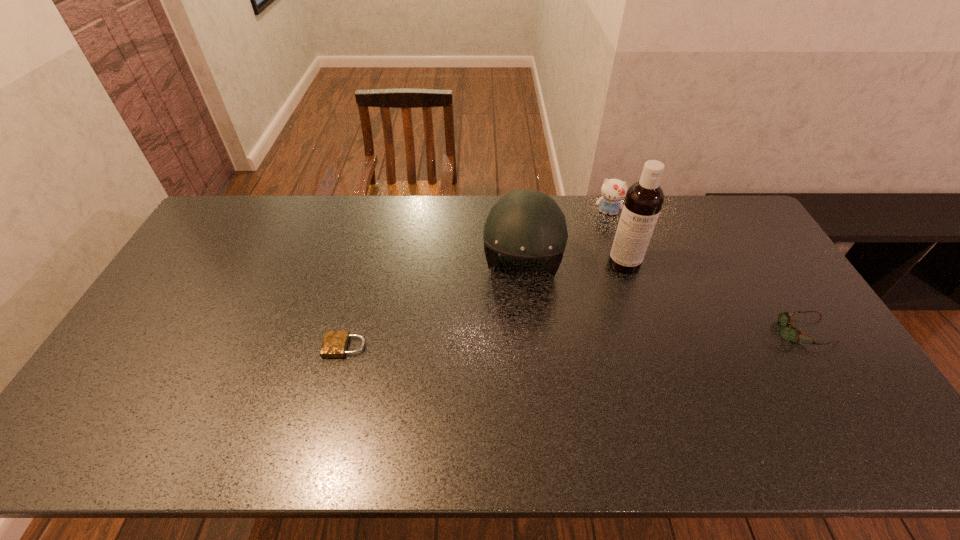
Locate an element on the screen. The height and width of the screenshot is (540, 960). vacant spot on the desktop that is between the padlock and the fourth tallest object and is positioned on the front-facing side of the third shortest object is located at coordinates (586, 339).

The height and width of the screenshot is (540, 960). I want to click on vacant space on the desktop that is between the shortest object and the spectacles and is positioned on the label side of the dishwasher detergent, so click(x=638, y=337).

Locate an element on the screen. The image size is (960, 540). free space on the desktop that is between the leftmost object and the spectacles and is positioned at the face opening of the football helmet is located at coordinates (513, 341).